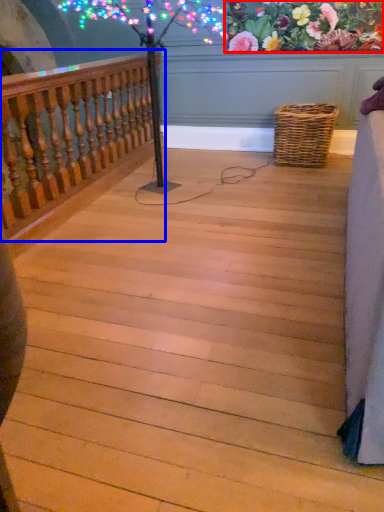
Question: Among these objects, which one is farthest to the camera, floral arrangement (highlighted by a red box) or rail (highlighted by a blue box)?

Choices:
 (A) floral arrangement
 (B) rail

Answer: (A)